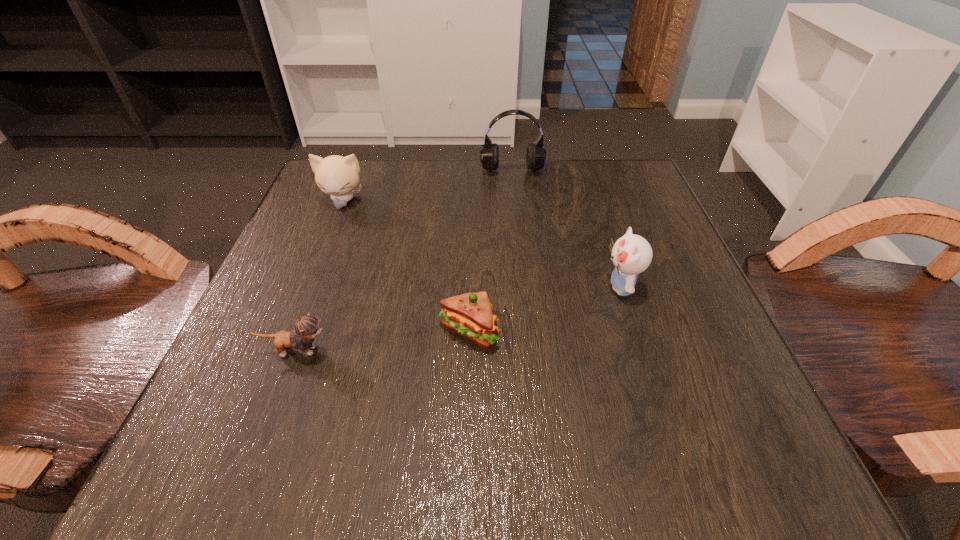
Image resolution: width=960 pixels, height=540 pixels. I want to click on free space located on the face of the farthest kitten, so click(280, 362).

Identify the location of free space located on the back of the sandwich. The width and height of the screenshot is (960, 540). click(x=470, y=248).

Identify the location of free spot located on the front-facing side of the shortest kitten. pyautogui.click(x=487, y=351).

You are a GUI agent. You are given a task and a screenshot of the screen. Output one action in this format:
    pyautogui.click(x=<x>, y=<y>)
    Task: Click on the headset that is positioned at the far edge
    This screenshot has width=960, height=540.
    Given the screenshot: What is the action you would take?
    pyautogui.click(x=535, y=155)

This screenshot has height=540, width=960. In order to click on kitten that is at the far edge in this screenshot , I will do `click(335, 175)`.

Find the location of `object at the right edge`. object at the right edge is located at coordinates (632, 254).

Where is `object present at the far left corner`? The height and width of the screenshot is (540, 960). object present at the far left corner is located at coordinates (335, 175).

Identify the location of vacant area at the far edge of the desktop. This screenshot has height=540, width=960. (538, 211).

This screenshot has width=960, height=540. Find the location of `free location at the near edge`. free location at the near edge is located at coordinates (432, 425).

The image size is (960, 540). I want to click on vacant space at the left edge of the desktop, so click(335, 335).